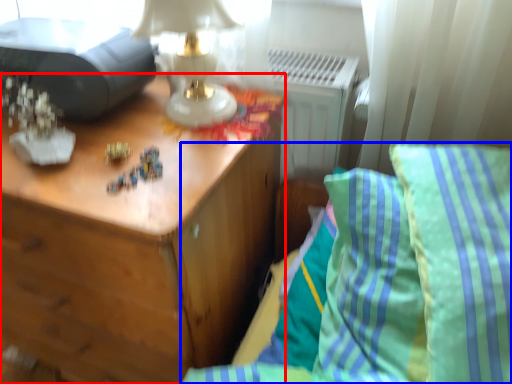
Question: Which object is closer to the camera taking this photo, nightstand (highlighted by a red box) or furniture (highlighted by a blue box)?

Choices:
 (A) nightstand
 (B) furniture

Answer: (B)